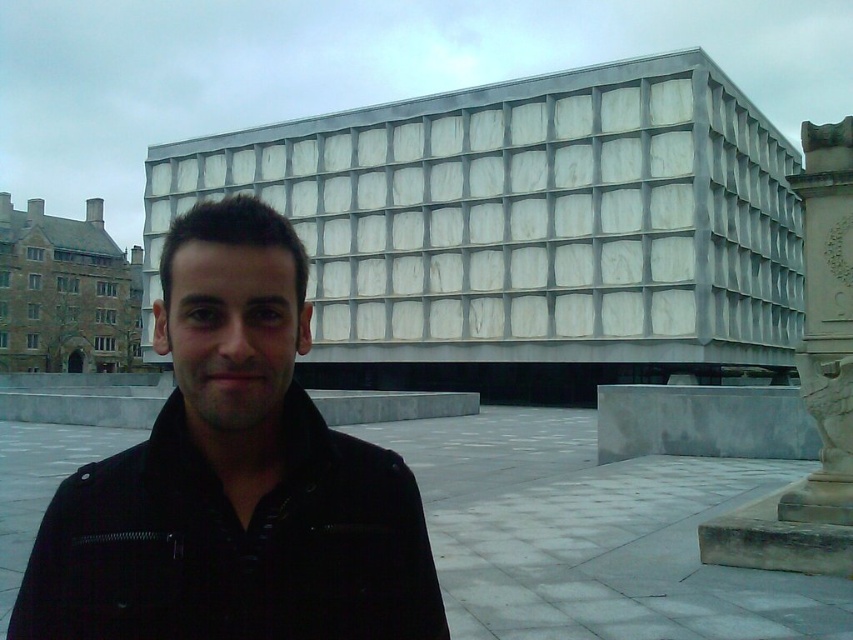
Consider the image. Is black leather jacket at center bigger than white stone column at right?

No, black leather jacket at center is not bigger than white stone column at right.

What do you see at coordinates (233, 477) in the screenshot? I see `black leather jacket at center` at bounding box center [233, 477].

What do you see at coordinates (233, 477) in the screenshot? I see `black leather jacket at center` at bounding box center [233, 477].

The image size is (853, 640). I want to click on black leather jacket at center, so click(233, 477).